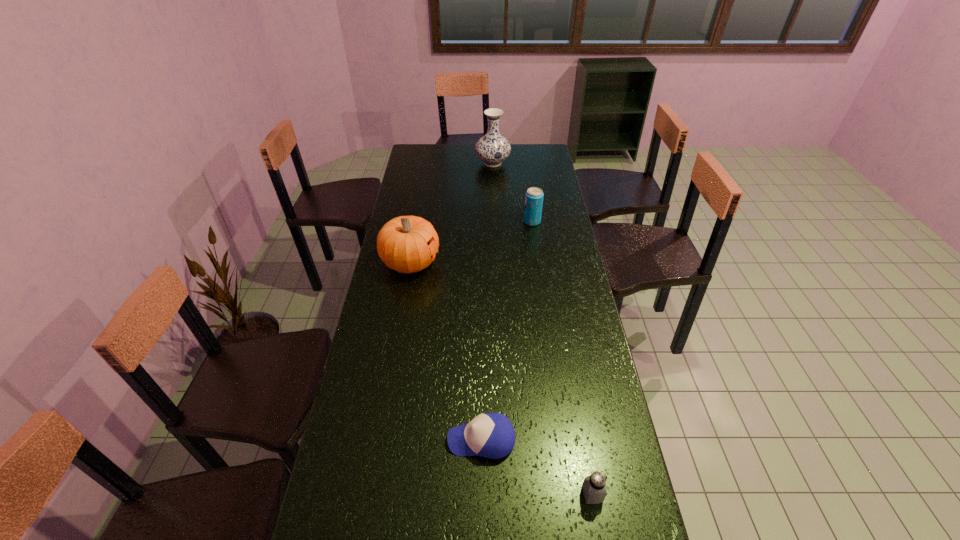
Locate an element on the screen. The image size is (960, 540). the farthest object is located at coordinates (492, 148).

The width and height of the screenshot is (960, 540). Find the location of `the tallest object`. the tallest object is located at coordinates (492, 148).

Where is `pumpkin`? Image resolution: width=960 pixels, height=540 pixels. pumpkin is located at coordinates (407, 244).

The width and height of the screenshot is (960, 540). I want to click on the third farthest object, so click(x=407, y=244).

Locate an element on the screen. the fourth nearest object is located at coordinates (534, 196).

This screenshot has width=960, height=540. What are the coordinates of `the third tallest object` in the screenshot? It's located at (534, 196).

Identify the location of the nearest object. (594, 486).

Find the location of a particular element. This screenshot has height=540, width=960. baseball cap is located at coordinates (491, 435).

You are a GUI agent. You are given a task and a screenshot of the screen. Output one action in this format:
    pyautogui.click(x=<x>, y=<y>)
    Task: Click on the vacant space located on the front of the farthest object
    This screenshot has height=540, width=960.
    Given the screenshot: What is the action you would take?
    pyautogui.click(x=493, y=183)

Locate an element on the screen. The image size is (960, 540). vacant point located on the front-facing side of the third farthest object is located at coordinates (463, 262).